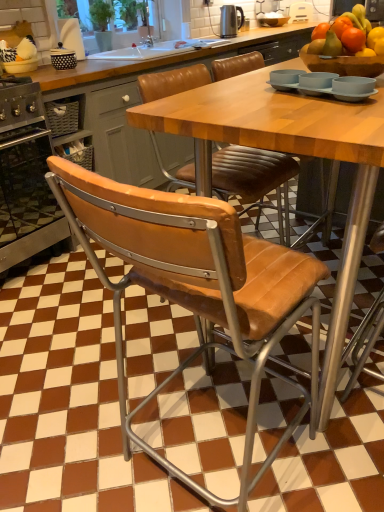
Locate an element on the screen. The height and width of the screenshot is (512, 384). polished stainless steel kettle at upper center, the second appliance positioned from the back is located at coordinates (230, 21).

In terms of height, does white plastic toaster at upper center, the 2th appliance from the left, look taller or shorter compared to leather-like tan chair at center?

white plastic toaster at upper center, the 2th appliance from the left, is taller than leather-like tan chair at center.

Is white plastic toaster at upper center, the 2th appliance from the left, further to camera compared to leather-like tan chair at center?

Yes, it is behind leather-like tan chair at center.

The width and height of the screenshot is (384, 512). I want to click on chair that appears below the white plastic toaster at upper center, the 2th appliance from the left (from the image's perspective), so click(x=196, y=287).

Can you confirm if stainless steel oven at left is smaller than polished stainless steel kettle at upper center, positioned as the first appliance in bottom-to-top order?

Incorrect, stainless steel oven at left is not smaller in size than polished stainless steel kettle at upper center, positioned as the first appliance in bottom-to-top order.

Considering the points (12, 238) and (231, 25), which point is in front, point (12, 238) or point (231, 25)?

The point (12, 238) is closer.

Looking at their sizes, would you say stainless steel oven at left is wider or thinner than polished stainless steel kettle at upper center, which is the second appliance from top to bottom?

In the image, stainless steel oven at left appears to be wider than polished stainless steel kettle at upper center, which is the second appliance from top to bottom.

Is stainless steel oven at left directly adjacent to polished stainless steel kettle at upper center, positioned as the first appliance in bottom-to-top order?

No, stainless steel oven at left is not with polished stainless steel kettle at upper center, positioned as the first appliance in bottom-to-top order.

From the image's perspective, would you say stainless steel oven at left is shown under white plastic toaster at upper center, the 2th appliance from the left?

Yes, from the image's perspective, stainless steel oven at left is beneath white plastic toaster at upper center, the 2th appliance from the left.

Considering the sizes of objects stainless steel oven at left and white plastic toaster at upper center, which is counted as the 1th appliance, starting from the back, in the image provided, who is wider, stainless steel oven at left or white plastic toaster at upper center, which is counted as the 1th appliance, starting from the back,?

With larger width is stainless steel oven at left.

Between point (44, 230) and point (304, 19), which one is positioned in front?

Point (44, 230)

Is the depth of stainless steel oven at left greater than that of white plastic toaster at upper center, the 2th appliance in the bottom-to-top sequence?

That is False.

Is point (117, 189) closer or farther from the camera than point (303, 6)?

Point (117, 189) is positioned closer to the camera compared to point (303, 6).

From a real-world perspective, is leather-like tan chair at center above or below white plastic toaster at upper center, the 2th appliance in the bottom-to-top sequence?

From a real-world perspective, leather-like tan chair at center is physically below white plastic toaster at upper center, the 2th appliance in the bottom-to-top sequence.

Is leather-like tan chair at center bigger than white plastic toaster at upper center, the 1th appliance when ordered from top to bottom?

Yes, leather-like tan chair at center is bigger than white plastic toaster at upper center, the 1th appliance when ordered from top to bottom.

From the image's perspective, who appears lower, leather-like tan chair at center or white plastic toaster at upper center, the 1th appliance when ordered from top to bottom?

leather-like tan chair at center.

Would you say polished stainless steel kettle at upper center, which is the second appliance from top to bottom, is part of leather-like tan chair at center's contents?

No, polished stainless steel kettle at upper center, which is the second appliance from top to bottom, is not surrounded by leather-like tan chair at center.

From their relative heights in the image, would you say leather-like tan chair at center is taller or shorter than polished stainless steel kettle at upper center, marked as the 1th appliance in a front-to-back arrangement?

Clearly, leather-like tan chair at center is shorter compared to polished stainless steel kettle at upper center, marked as the 1th appliance in a front-to-back arrangement.

Between leather-like tan chair at center and polished stainless steel kettle at upper center, the first appliance positioned from the left, which one has larger width?

Wider between the two is leather-like tan chair at center.

From the image's perspective, would you say leather-like tan chair at center is shown under polished stainless steel kettle at upper center, positioned as the first appliance in bottom-to-top order?

Indeed, from the image's perspective, leather-like tan chair at center is shown beneath polished stainless steel kettle at upper center, positioned as the first appliance in bottom-to-top order.

Based on the photo, does white plastic toaster at upper center, the second appliance in the front-to-back sequence, have a greater width compared to stainless steel oven at left?

Incorrect, the width of white plastic toaster at upper center, the second appliance in the front-to-back sequence, does not surpass that of stainless steel oven at left.

Is point (290, 7) positioned in front of point (19, 236)?

No.

Visually, is white plastic toaster at upper center, the 1th appliance when ordered from top to bottom, positioned to the left or to the right of stainless steel oven at left?

white plastic toaster at upper center, the 1th appliance when ordered from top to bottom, is to the right of stainless steel oven at left.

In the scene shown: Considering the positions of objects white plastic toaster at upper center, which is counted as the 1th appliance, starting from the back, and stainless steel oven at left in the image provided, who is in front, white plastic toaster at upper center, which is counted as the 1th appliance, starting from the back, or stainless steel oven at left?

stainless steel oven at left is more forward.

Image resolution: width=384 pixels, height=512 pixels. I want to click on oven that appears above the leather-like tan chair at center (from a real-world perspective), so click(25, 176).

Can you confirm if leather-like tan chair at center is bigger than stainless steel oven at left?

Indeed, leather-like tan chair at center has a larger size compared to stainless steel oven at left.

Is point (92, 237) closer to viewer compared to point (43, 224)?

Yes, point (92, 237) is closer to viewer.

Is leather-like tan chair at center to the right of stainless steel oven at left from the viewer's perspective?

Yes.

This screenshot has height=512, width=384. Find the location of `chair to the left of white plastic toaster at upper center, the 2th appliance from the left`. chair to the left of white plastic toaster at upper center, the 2th appliance from the left is located at coordinates (196, 287).

From a real-world perspective, count 2nd appliances upward from the stainless steel oven at left and point to it. Please provide its 2D coordinates.

[(230, 21)]

From the image, which object appears to be nearer to polished stainless steel kettle at upper center, marked as the 1th appliance in a front-to-back arrangement, stainless steel oven at left or leather-like tan chair at center?

stainless steel oven at left.

Estimate the real-world distances between objects in this image. Which object is further from stainless steel oven at left, leather-like tan chair at center or polished stainless steel kettle at upper center, marked as the 1th appliance in a front-to-back arrangement?

polished stainless steel kettle at upper center, marked as the 1th appliance in a front-to-back arrangement.

Considering their positions, is leather-like tan chair at center positioned further to stainless steel oven at left than white plastic toaster at upper center, the second appliance in the front-to-back sequence?

white plastic toaster at upper center, the second appliance in the front-to-back sequence, lies further to stainless steel oven at left than the other object.

Based on their spatial positions, is leather-like tan chair at center or stainless steel oven at left closer to white plastic toaster at upper center, the second appliance in the front-to-back sequence?

The object closer to white plastic toaster at upper center, the second appliance in the front-to-back sequence, is stainless steel oven at left.

Based on their spatial positions, is white plastic toaster at upper center, marked as the first appliance in a right-to-left arrangement, or stainless steel oven at left closer to polished stainless steel kettle at upper center, marked as the 1th appliance in a front-to-back arrangement?

Based on the image, white plastic toaster at upper center, marked as the first appliance in a right-to-left arrangement, appears to be nearer to polished stainless steel kettle at upper center, marked as the 1th appliance in a front-to-back arrangement.

Looking at the image, which one is located closer to white plastic toaster at upper center, the 2th appliance from the left, stainless steel oven at left or polished stainless steel kettle at upper center, marked as the 1th appliance in a front-to-back arrangement?

polished stainless steel kettle at upper center, marked as the 1th appliance in a front-to-back arrangement, is closer to white plastic toaster at upper center, the 2th appliance from the left.

Estimate the real-world distances between objects in this image. Which object is further from leather-like tan chair at center, white plastic toaster at upper center, the second appliance in the front-to-back sequence, or polished stainless steel kettle at upper center, which is the second appliance from top to bottom?

white plastic toaster at upper center, the second appliance in the front-to-back sequence, is further to leather-like tan chair at center.

Looking at the image, which one is located closer to white plastic toaster at upper center, the second appliance in the front-to-back sequence, polished stainless steel kettle at upper center, marked as the 1th appliance in a front-to-back arrangement, or leather-like tan chair at center?

Among the two, polished stainless steel kettle at upper center, marked as the 1th appliance in a front-to-back arrangement, is located nearer to white plastic toaster at upper center, the second appliance in the front-to-back sequence.

The height and width of the screenshot is (512, 384). I want to click on oven located between leather-like tan chair at center and white plastic toaster at upper center, which is counted as the 1th appliance, starting from the back, in the depth direction, so click(x=25, y=176).

You are a GUI agent. You are given a task and a screenshot of the screen. Output one action in this format:
    pyautogui.click(x=<x>, y=<y>)
    Task: Click on the appliance located between stainless steel oven at left and white plastic toaster at upper center, which is counted as the 1th appliance, starting from the back, in the depth direction
    
    Given the screenshot: What is the action you would take?
    pyautogui.click(x=230, y=21)

The image size is (384, 512). I want to click on oven located between leather-like tan chair at center and polished stainless steel kettle at upper center, arranged as the 2th appliance when viewed from the right, in the depth direction, so click(x=25, y=176).

Locate an element on the screen. appliance between leather-like tan chair at center and white plastic toaster at upper center, which is counted as the 1th appliance, starting from the back, from front to back is located at coordinates (230, 21).